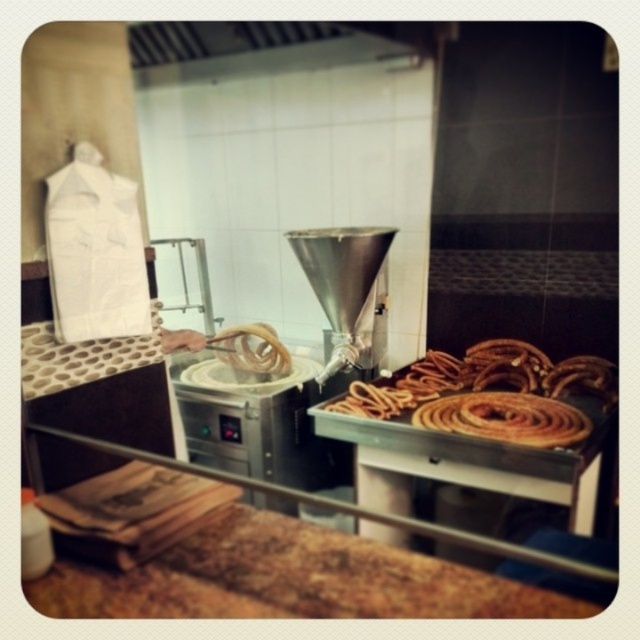
You are a customer at the bakery and want to choose between the crispy golden churros at center and the brown crispy pastry at right. If you prefer a wider snack, which one should you pick?

The crispy golden churros at center is wider than the brown crispy pastry at right, so you should pick the crispy golden churros at center for a wider snack.

You are a customer at the bakery and want to choose between the crispy golden churros at center and the brown crispy pastry at right. If you prefer items closer to the middle of the display, which one should you pick?

The crispy golden churros at center are closer to the middle of the display than the brown crispy pastry at right, so you should pick the crispy golden churros at center.

You are a customer at the bakery and want to grab both the crispy golden churros at center and the brown crispy pastry at right. Which one should you reach for first if you want to pick up the one closer to you?

The crispy golden churros at center is closer to you since it is located above the brown crispy pastry at right, meaning it is nearer in the vertical plane.